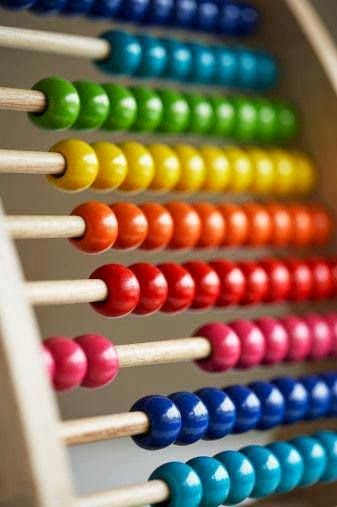
Where is `wooden abacus rows`? The image size is (337, 507). wooden abacus rows is located at coordinates (144, 488), (136, 420), (150, 353), (40, 226), (39, 161), (15, 100), (44, 38).